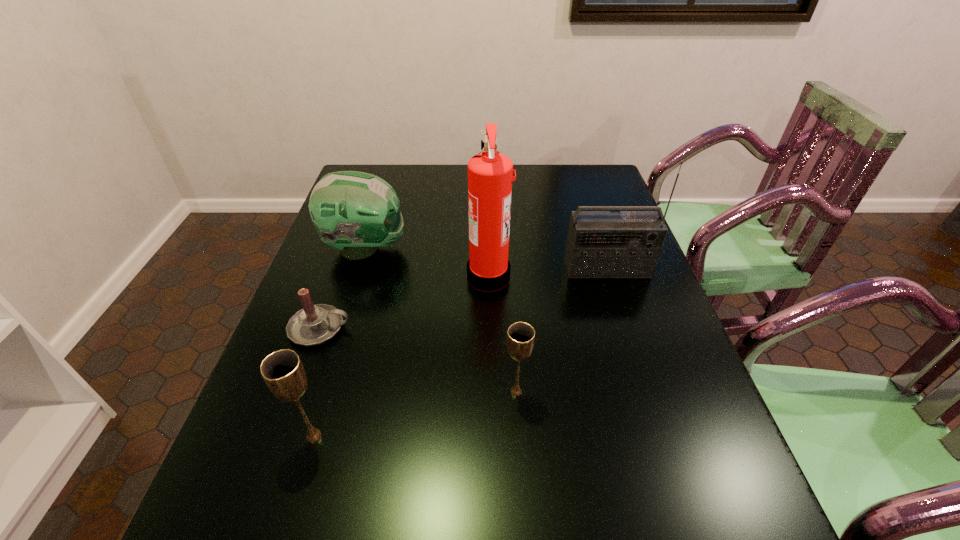
The image size is (960, 540). I want to click on vacant space located 0.300m on the back of the left chalice, so click(x=351, y=311).

Locate an element on the screen. This screenshot has height=540, width=960. vacant space located on the right of the shorter chalice is located at coordinates (682, 392).

I want to click on free space located on the front panel of the fifth shortest object, so click(627, 330).

Locate an element on the screen. The width and height of the screenshot is (960, 540). vacant space located with the nozzle aimed from the fire extinguisher is located at coordinates (400, 275).

You are a GUI agent. You are given a task and a screenshot of the screen. Output one action in this format:
    pyautogui.click(x=<x>, y=<y>)
    Task: Click on the vacant space situated with the nozzle aimed from the fire extinguisher
    The width and height of the screenshot is (960, 540).
    Given the screenshot: What is the action you would take?
    pyautogui.click(x=408, y=275)

Where is `free region located 0.360m with the nozzle aimed from the fire extinguisher`? Image resolution: width=960 pixels, height=540 pixels. free region located 0.360m with the nozzle aimed from the fire extinguisher is located at coordinates (334, 275).

Image resolution: width=960 pixels, height=540 pixels. What are the coordinates of `vacant space located on the side of the third nearest object with the handle loop` in the screenshot? It's located at (413, 328).

Where is `free region located 0.060m on the visor of the football helmet`? This screenshot has height=540, width=960. free region located 0.060m on the visor of the football helmet is located at coordinates (427, 248).

This screenshot has height=540, width=960. What are the coordinates of `object situated at the near edge` in the screenshot? It's located at (283, 372).

Locate an element on the screen. chalice that is positioned at the left edge is located at coordinates (283, 372).